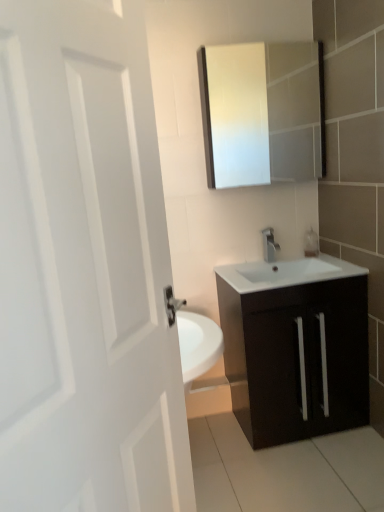
Where is `free point below white glossy medicine cabinet at upper center (from a real-world perspective)`? Image resolution: width=384 pixels, height=512 pixels. free point below white glossy medicine cabinet at upper center (from a real-world perspective) is located at coordinates (263, 262).